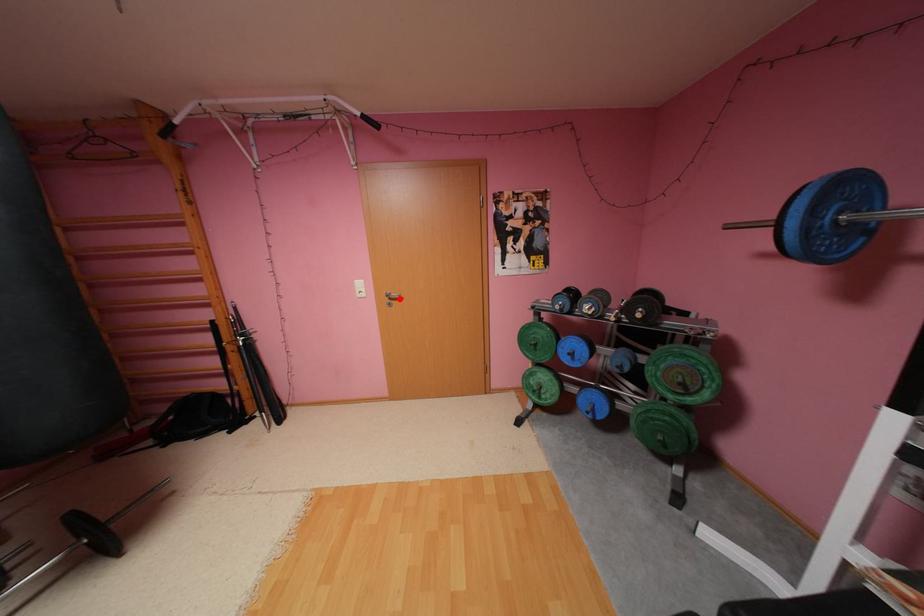
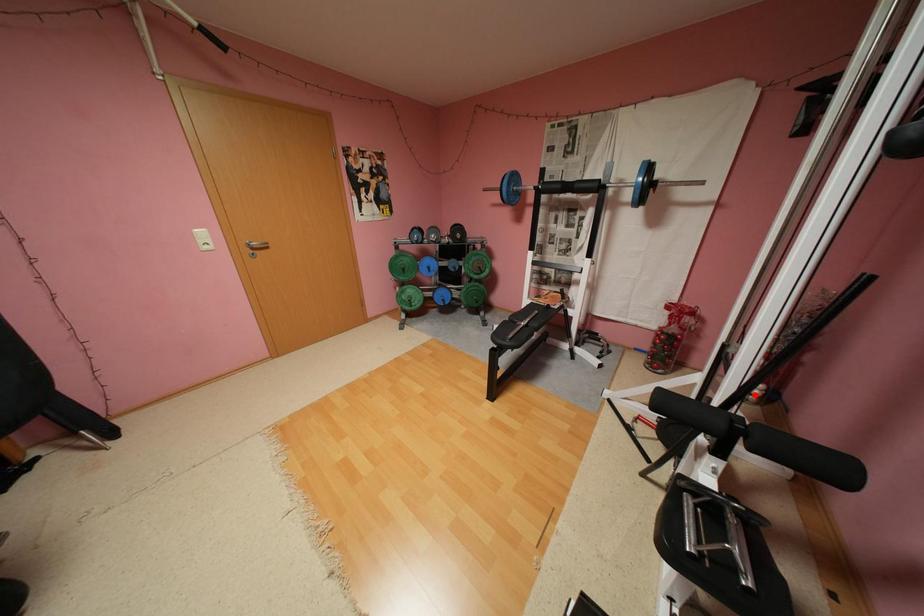
I am providing you with two images of the same scene from different viewpoints. A red point is marked on the first image and another point is marked on the second image. Are the points marked in image1 and image2 representing the same 3D position?

No